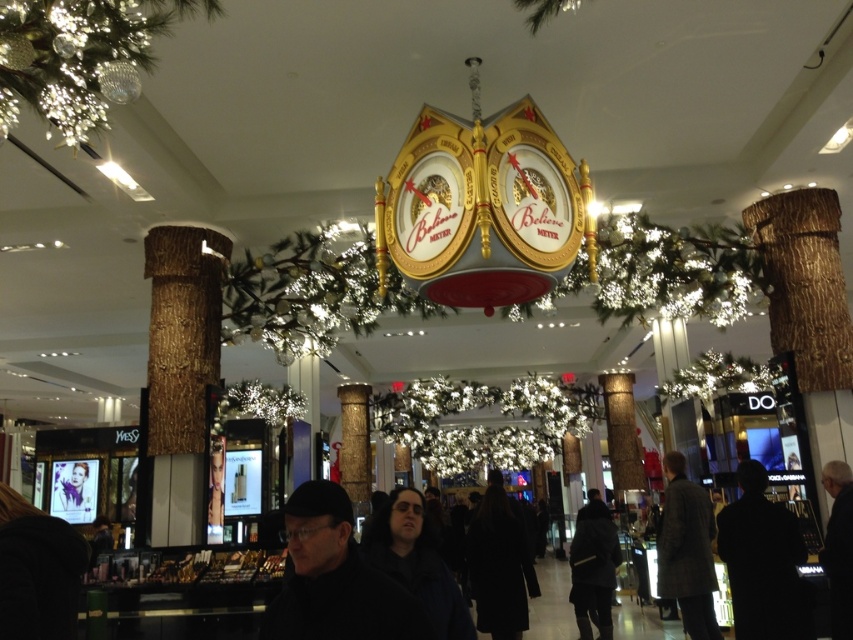
You are a shopper looking for a coat to try on. You see the silhouette jacket at lower right and the dark matte coat at center. Which coat is positioned closer to the right side of the image?

The silhouette jacket at lower right is positioned to the right of the dark matte coat at center, so it is closer to the right side of the image.

You are shopping for a coat and see both the black matte coat at center and the dark gray coat at lower left. Which coat is positioned lower in the store display?

The black matte coat at center is positioned lower than the dark gray coat at lower left.